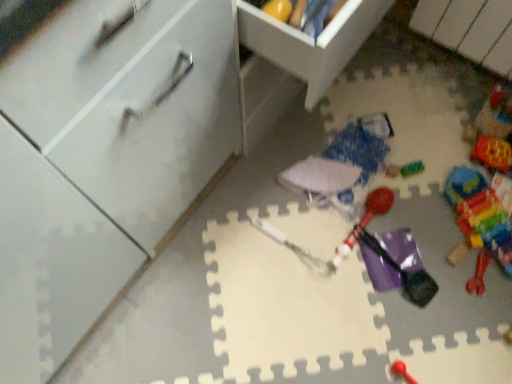
Question: Considering the positions of translucent plastic bag at center, positioned as the 3th toy in left-to-right order, and translucent plastic blocks at lower right, acting as the 7th toy starting from the left, in the image, is translucent plastic bag at center, positioned as the 3th toy in left-to-right order, wider or thinner than translucent plastic blocks at lower right, acting as the 7th toy starting from the left,?

Choices:
 (A) thin
 (B) wide

Answer: (A)

Question: From the image's perspective, is translucent plastic bag at center, positioned as the 3th toy in left-to-right order, located above or below translucent plastic blocks at lower right, acting as the 7th toy starting from the left?

Choices:
 (A) above
 (B) below

Answer: (A)

Question: Considering the real-world distances, which object is closest to the white matte drawer at upper center, which is the second cabinetry from left to right?

Choices:
 (A) white fabric umbrella at center, positioned as the first toy in left-to-right order
 (B) multicolored plastic blocks at right, acting as the 6th toy starting from the left
 (C) rubber red toy at lower right, which is counted as the 5th toy, starting from the left
 (D) white matte cabinet at left, which is the first cabinetry from left to right
 (E) rubberized red mallet at center, the 2th toy from the left

Answer: (D)

Question: Estimate the real-world distances between objects in this image. Which object is farther from the translucent plastic bag at center, positioned as the 3th toy in left-to-right order?

Choices:
 (A) rubberized red mallet at center, the sixth toy in the right-to-left sequence
 (B) rubber red toy at lower right, which is counted as the 5th toy, starting from the left
 (C) multicolored plastic blocks at right, which is the 2th toy in right-to-left order
 (D) white matte cabinet at left, which is the second cabinetry in right-to-left order
 (E) white matte drawer at upper center, which appears as the 1th cabinetry when viewed from the right

Answer: (D)